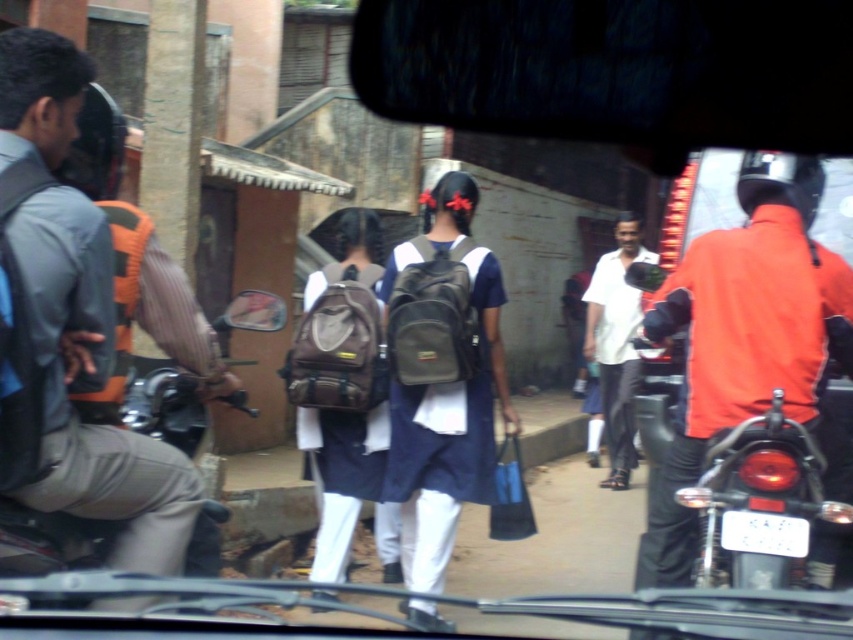
You are a delivery person who needs to choose a helmet and a backpack for your delivery route. The orange fabric helmet at right and the gray fabric backpack at left are available. Considering their sizes, which one would you choose for better visibility and comfort?

The orange fabric helmet at right has a larger width than the gray fabric backpack at left, so choosing the orange fabric helmet at right would provide better visibility due to its larger size and bright color, while the gray fabric backpack at left might be more comfortable for carrying items as it is smaller and possibly lighter.

You are a passenger in the vehicle and want to describe the location of the brown fabric backpack at center to a friend. Where is it located in the image?

The brown fabric backpack at center is located at point (341, 392) in the image.